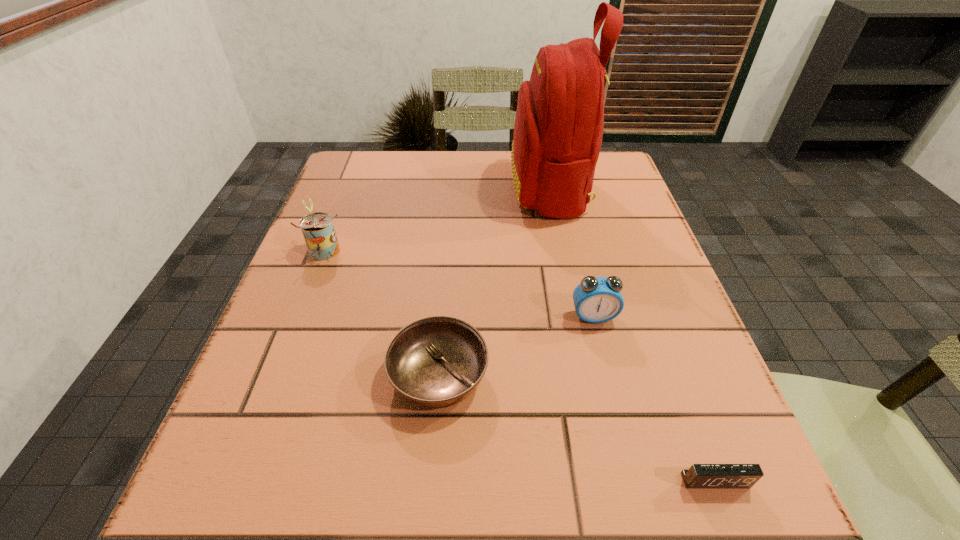
Identify the location of free point between the tallest object and the fourth tallest object. (494, 281).

Locate an element on the screen. Image resolution: width=960 pixels, height=540 pixels. free space between the can and the second object from left to right is located at coordinates (380, 313).

The width and height of the screenshot is (960, 540). I want to click on empty space between the can and the backpack, so click(436, 219).

Locate an element on the screen. free space between the nearer alarm clock and the leftmost object is located at coordinates (518, 365).

You are a GUI agent. You are given a task and a screenshot of the screen. Output one action in this format:
    pyautogui.click(x=<x>, y=<y>)
    Task: Click on the free space that is in between the second nearest object and the right alarm clock
    Image resolution: width=960 pixels, height=540 pixels.
    Given the screenshot: What is the action you would take?
    pyautogui.click(x=577, y=428)

At what (x,y) coordinates should I click in order to perform the action: click on vacant area between the farthest object and the can. Please return your answer as a coordinate pair (x, y). Looking at the image, I should click on (436, 219).

Identify the location of empty space that is in between the second shortest object and the farthest object. The width and height of the screenshot is (960, 540). (494, 281).

The width and height of the screenshot is (960, 540). Identify the location of unoccupied position between the nearest object and the fourth farthest object. (577, 428).

You are a GUI agent. You are given a task and a screenshot of the screen. Output one action in this format:
    pyautogui.click(x=<x>, y=<y>)
    Task: Click on the empty space between the third farthest object and the shortest object
    This screenshot has width=960, height=540.
    Given the screenshot: What is the action you would take?
    (x=655, y=399)

Locate which object ranks third in proximity to the left alarm clock. Please provide its 2D coordinates. Your answer should be formatted as a tuple, i.e. [(x, y)], where the tuple contains the x and y coordinates of a point satisfying the conditions above.

[(699, 476)]